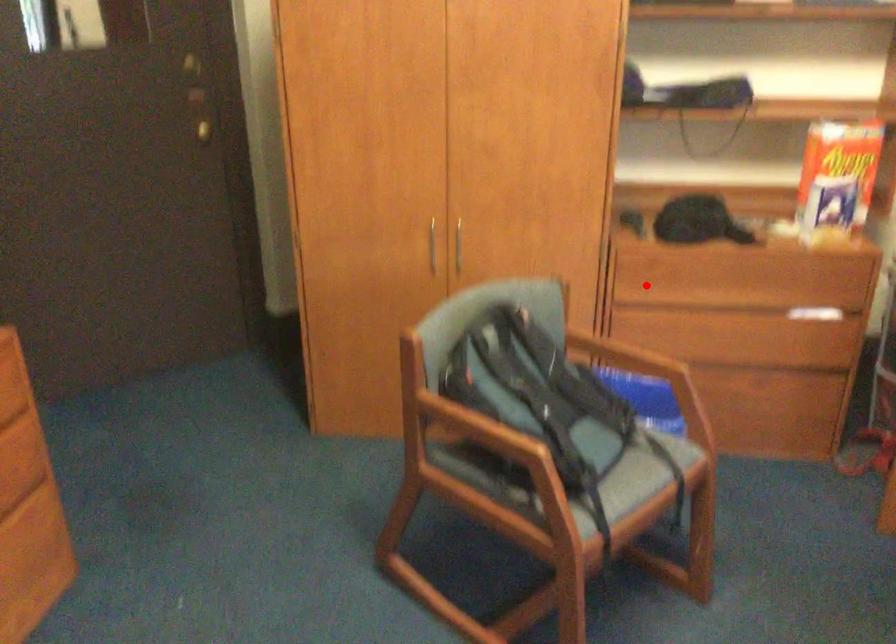
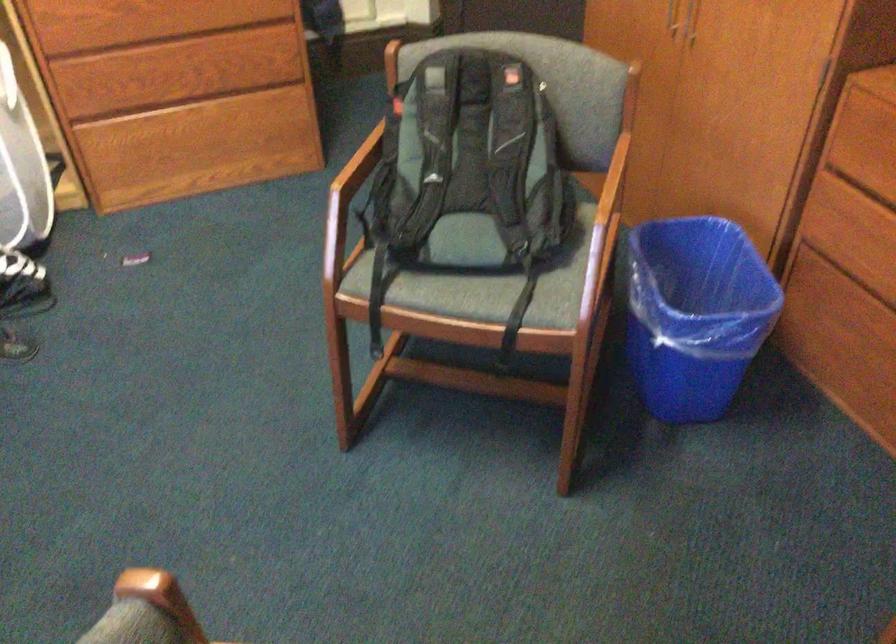
The point at the highlighted location is marked in the first image. Where is the corresponding point in the second image?

(864, 161)